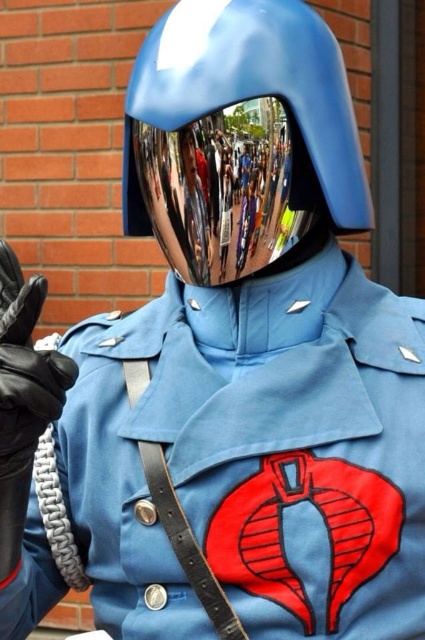
You are a costume designer preparing for a theater performance. You have to ensure that the shiny metallic helmet at center and the black leather glove at lower left fit within the stage backdrop. The stage backdrop is 2 meters wide. If the helmet is wider than the glove, will both items fit side by side within the backdrop without overlapping?

The shiny metallic helmet at center is wider than the black leather glove at lower left. However, without knowing their exact widths, it is impossible to determine if both can fit side by side within the 2 meter backdrop. Additional measurements are needed.

You are a photographer trying to capture a closeup of the shiny metallic helmet at center and the black leather glove at lower left. Since the helmet is reflecting the surroundings, will you need to adjust your camera angle to avoid capturing the glove in the reflection?

The shiny metallic helmet at center is above the black leather glove at lower left, so adjusting the camera angle downward might prevent the glove from appearing in the helmet reflection.

You are a photographer trying to capture the reflection in the shiny metallic helmet at center and the black leather glove at lower left. Which object is closer to the right edge of the image?

The shiny metallic helmet at center is positioned on the right side of the black leather glove at lower left, so the shiny metallic helmet at center is closer to the right edge of the image.